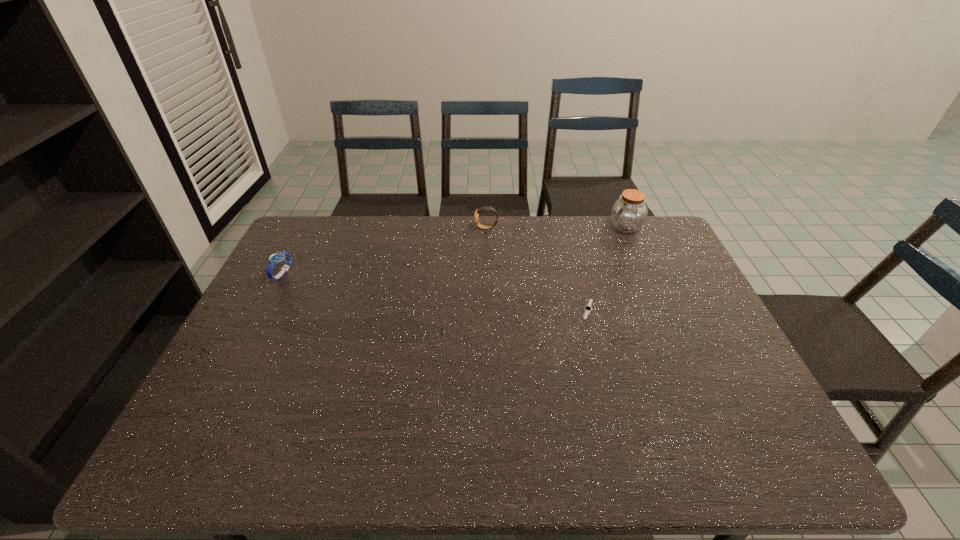
The width and height of the screenshot is (960, 540). I want to click on the rightmost object, so click(x=629, y=213).

Identify the location of jar. (629, 213).

The image size is (960, 540). What are the coordinates of `the second tallest object` in the screenshot? It's located at (485, 208).

What are the coordinates of `the tallest watch` in the screenshot? It's located at (485, 208).

Where is `the leftmost watch`? the leftmost watch is located at coordinates (276, 258).

Where is `the third tallest object`? the third tallest object is located at coordinates click(x=276, y=258).

Identify the location of the shortest watch. The width and height of the screenshot is (960, 540). click(588, 308).

Identify the location of the rightmost watch. (588, 308).

At what (x,y) coordinates should I click in order to perform the action: click on vacant space located on the front of the jar. Please return your answer as a coordinate pair (x, y). Image resolution: width=960 pixels, height=540 pixels. Looking at the image, I should click on (649, 280).

Image resolution: width=960 pixels, height=540 pixels. In order to click on vacant point located 0.200m on the face of the tallest watch in this screenshot , I will do `click(419, 228)`.